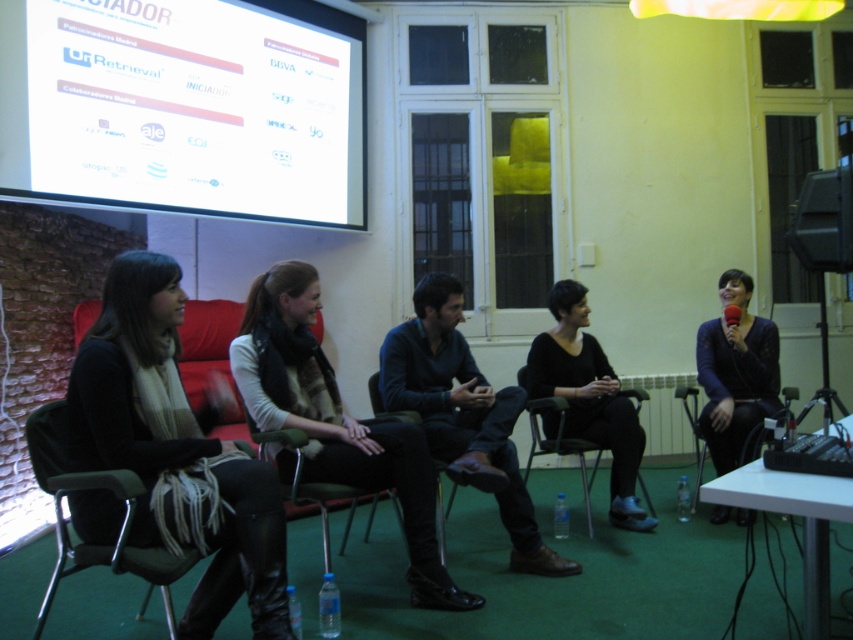
Question: Which point is farther to the camera?

Choices:
 (A) (697, 465)
 (B) (589, 516)

Answer: (A)

Question: Which point is closer to the camera taking this photo?

Choices:
 (A) (115, 541)
 (B) (367, 484)

Answer: (A)

Question: Is black leather jacket at left smaller than black fabric chair at center?

Choices:
 (A) yes
 (B) no

Answer: (A)

Question: Which object appears farthest from the camera in this image?

Choices:
 (A) green plastic chair at lower left
 (B) white glossy projection screen at upper left
 (C) black leather jacket at left
 (D) metallic silver chair at lower right

Answer: (D)

Question: Does green plastic chair at lower left have a smaller size compared to metallic silver chair at lower right?

Choices:
 (A) no
 (B) yes

Answer: (B)

Question: Observing the image, what is the correct spatial positioning of black leather jacket at left in reference to green plastic chair at lower left?

Choices:
 (A) right
 (B) left

Answer: (A)